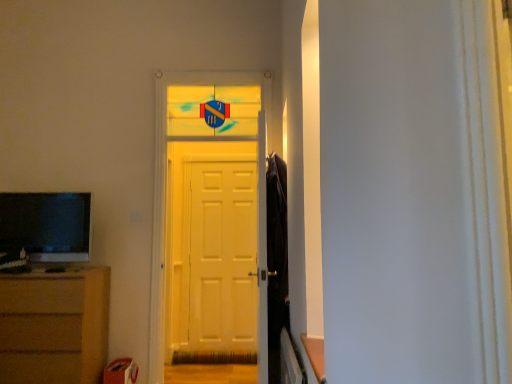
Question: Would you say white glossy door at center is outside matte black television at left?

Choices:
 (A) yes
 (B) no

Answer: (A)

Question: From the image's perspective, is white glossy door at center above matte black television at left?

Choices:
 (A) no
 (B) yes

Answer: (B)

Question: Is white glossy door at center beside matte black television at left?

Choices:
 (A) yes
 (B) no

Answer: (B)

Question: Is white glossy door at center further to the viewer compared to matte black television at left?

Choices:
 (A) no
 (B) yes

Answer: (B)

Question: Is white glossy door at center turned away from matte black television at left?

Choices:
 (A) no
 (B) yes

Answer: (A)

Question: Is white glossy door at center inside the boundaries of matte black television at left, or outside?

Choices:
 (A) inside
 (B) outside

Answer: (B)

Question: In terms of width, does white glossy door at center look wider or thinner when compared to matte black television at left?

Choices:
 (A) wide
 (B) thin

Answer: (A)

Question: From a real-world perspective, relative to matte black television at left, is white glossy door at center vertically above or below?

Choices:
 (A) above
 (B) below

Answer: (A)

Question: Based on their sizes in the image, would you say white glossy door at center is bigger or smaller than matte black television at left?

Choices:
 (A) big
 (B) small

Answer: (A)

Question: Considering the positions of white matte door at center and white glossy door at center in the image, is white matte door at center wider or thinner than white glossy door at center?

Choices:
 (A) thin
 (B) wide

Answer: (A)

Question: Would you say white matte door at center is to the left or to the right of white glossy door at center in the picture?

Choices:
 (A) right
 (B) left

Answer: (A)

Question: In terms of size, does white matte door at center appear bigger or smaller than white glossy door at center?

Choices:
 (A) small
 (B) big

Answer: (A)

Question: From their relative heights in the image, would you say white matte door at center is taller or shorter than white glossy door at center?

Choices:
 (A) short
 (B) tall

Answer: (A)

Question: In the image, is brown wooden chest of drawers at lower left on the left side or the right side of matte black television at left?

Choices:
 (A) left
 (B) right

Answer: (A)

Question: Is brown wooden chest of drawers at lower left wider or thinner than matte black television at left?

Choices:
 (A) wide
 (B) thin

Answer: (A)